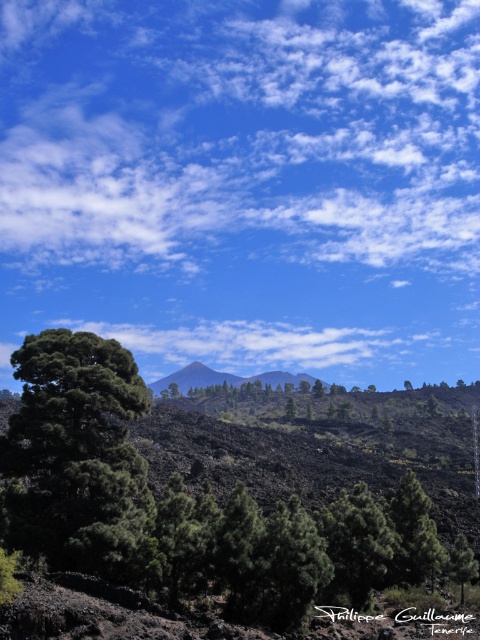
Based on the photo, can you confirm if dark green leafy tree at lower left is positioned above matte black mountain at center?

Yes, dark green leafy tree at lower left is above matte black mountain at center.

How much distance is there between dark green leafy tree at lower left and matte black mountain at center?

dark green leafy tree at lower left and matte black mountain at center are 1171.17 feet apart.

Between point (47, 365) and point (189, 384), which one is positioned behind?

Point (189, 384)

Identify the location of dark green leafy tree at lower left. (181, 504).

Measure the distance between white fluffy cloud at upper center and matte black mountain at center.

white fluffy cloud at upper center is 117.07 meters away from matte black mountain at center.

Which of these two, white fluffy cloud at upper center or matte black mountain at center, stands taller?

Standing taller between the two is white fluffy cloud at upper center.

Is point (25, 12) positioned after point (235, 376)?

Yes, it is.

Image resolution: width=480 pixels, height=640 pixels. Identify the location of white fluffy cloud at upper center. (244, 182).

Can you confirm if white fluffy cloud at upper center is taller than dark green leafy tree at lower left?

Indeed, white fluffy cloud at upper center has a greater height compared to dark green leafy tree at lower left.

Between white fluffy cloud at upper center and dark green leafy tree at lower left, which one is positioned lower?

dark green leafy tree at lower left

You are a GUI agent. You are given a task and a screenshot of the screen. Output one action in this format:
    pyautogui.click(x=<x>, y=<y>)
    Task: Click on the white fluffy cloud at upper center
    The image size is (480, 640).
    Given the screenshot: What is the action you would take?
    pyautogui.click(x=244, y=182)